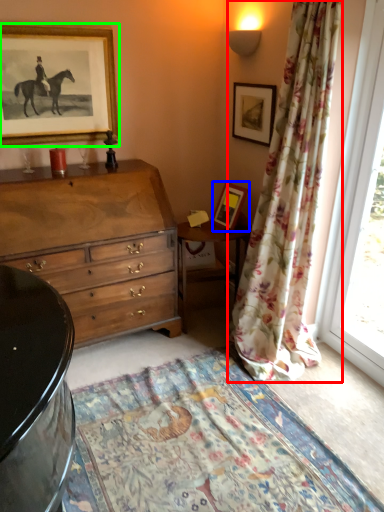
Question: Based on their relative distances, which object is farther from curtain (highlighted by a red box)? Choose from picture frame (highlighted by a blue box) and picture frame (highlighted by a green box).

Choices:
 (A) picture frame
 (B) picture frame

Answer: (B)